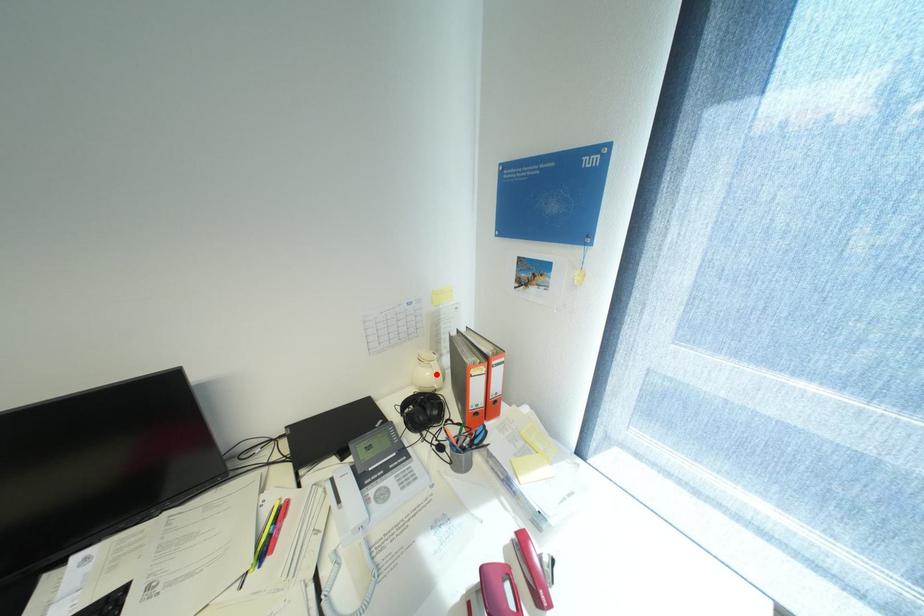
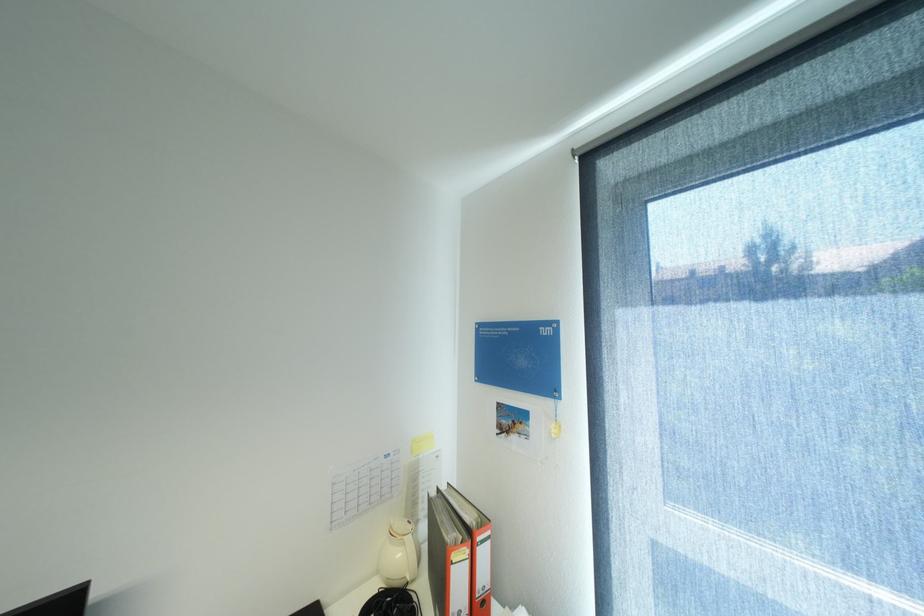
The point at the highlighted location is marked in the first image. Where is the corresponding point in the second image?

(407, 554)